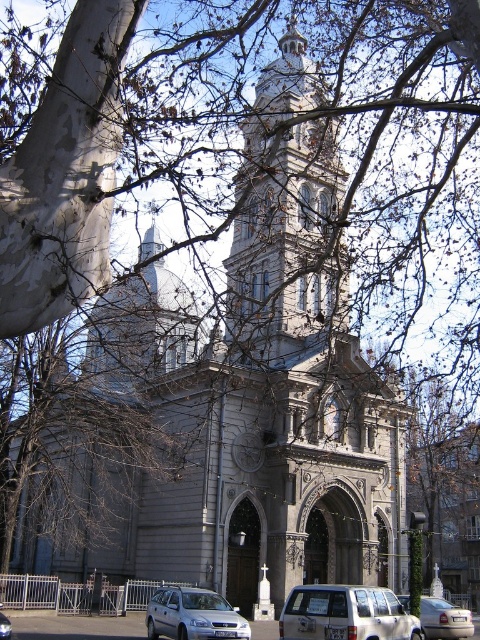
Question: Does stone tower at center appear under silver metallic car at lower right?

Choices:
 (A) yes
 (B) no

Answer: (B)

Question: Based on their relative distances, which object is nearer to the stone tower at center?

Choices:
 (A) silver metallic car at lower right
 (B) satin silver wagon at lower center

Answer: (B)

Question: Which point is farther from the camera taking this photo?

Choices:
 (A) (x=396, y=621)
 (B) (x=2, y=624)
 (C) (x=332, y=280)
 (D) (x=178, y=618)

Answer: (C)

Question: Can you confirm if silver metallic car at lower right is positioned to the left of silver metallic car at center?

Choices:
 (A) yes
 (B) no

Answer: (B)

Question: Which point is farther to the camera?

Choices:
 (A) satin silver wagon at lower center
 (B) silver metallic car at center
 (C) silver metallic car at lower right
 (D) stone tower at center

Answer: (C)

Question: Is satin silver wagon at lower center thinner than silver metallic car at center?

Choices:
 (A) no
 (B) yes

Answer: (A)